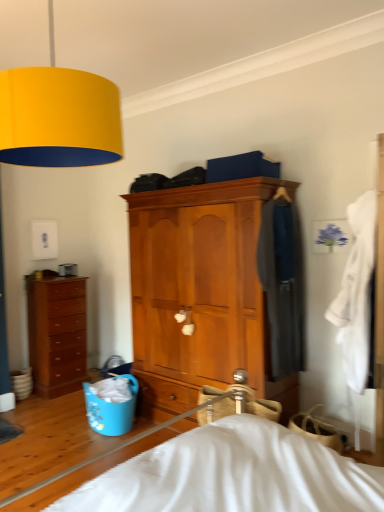
Question: Is the depth of wooden cabinet at center, positioned as the first chest of drawers in front-to-back order, less than that of dark gray fabric coat at center right, which ranks as the first clothing in back-to-front order?

Choices:
 (A) no
 (B) yes

Answer: (A)

Question: From the image's perspective, would you say wooden cabinet at center, which ranks as the 2th chest of drawers in left-to-right order, is shown under dark gray fabric coat at center right, which ranks as the first clothing in back-to-front order?

Choices:
 (A) no
 (B) yes

Answer: (B)

Question: Is wooden cabinet at center, positioned as the first chest of drawers in front-to-back order, placed right next to dark gray fabric coat at center right, the second clothing in the front-to-back sequence?

Choices:
 (A) yes
 (B) no

Answer: (B)

Question: Can you confirm if wooden cabinet at center, positioned as the first chest of drawers in front-to-back order, is bigger than dark gray fabric coat at center right, the second clothing in the front-to-back sequence?

Choices:
 (A) yes
 (B) no

Answer: (A)

Question: Is wooden cabinet at center, the 2th chest of drawers from the back, oriented towards dark gray fabric coat at center right, which ranks as the first clothing in back-to-front order?

Choices:
 (A) yes
 (B) no

Answer: (B)

Question: Could dark gray fabric coat at center right, which ranks as the first clothing in back-to-front order, be considered to be inside wooden cabinet at center, the 1th chest of drawers from the right?

Choices:
 (A) no
 (B) yes

Answer: (B)

Question: From the image's perspective, does wooden cabinet at center, positioned as the first chest of drawers in front-to-back order, appear lower than white cotton robe at right, which ranks as the 1th clothing in front-to-back order?

Choices:
 (A) yes
 (B) no

Answer: (A)

Question: Can you confirm if wooden cabinet at center, the 1th chest of drawers from the right, is taller than white cotton robe at right, which ranks as the 1th clothing in front-to-back order?

Choices:
 (A) no
 (B) yes

Answer: (B)

Question: Is wooden cabinet at center, positioned as the first chest of drawers in front-to-back order, far from white cotton robe at right, acting as the 2th clothing starting from the back?

Choices:
 (A) no
 (B) yes

Answer: (A)

Question: Is wooden cabinet at center, which ranks as the 2th chest of drawers in left-to-right order, oriented away from white cotton robe at right, which ranks as the 1th clothing in front-to-back order?

Choices:
 (A) yes
 (B) no

Answer: (B)

Question: Is wooden cabinet at center, positioned as the first chest of drawers in front-to-back order, facing towards white cotton robe at right, which ranks as the 1th clothing in front-to-back order?

Choices:
 (A) no
 (B) yes

Answer: (A)

Question: Is wooden cabinet at center, the 1th chest of drawers from the right, closer to the viewer compared to white cotton robe at right, acting as the 2th clothing starting from the back?

Choices:
 (A) no
 (B) yes

Answer: (A)

Question: Is wooden cabinet at center, which ranks as the 2th chest of drawers in left-to-right order, next to brown wooden chest of drawers at left, which appears as the 2th chest of drawers when viewed from the front?

Choices:
 (A) yes
 (B) no

Answer: (B)